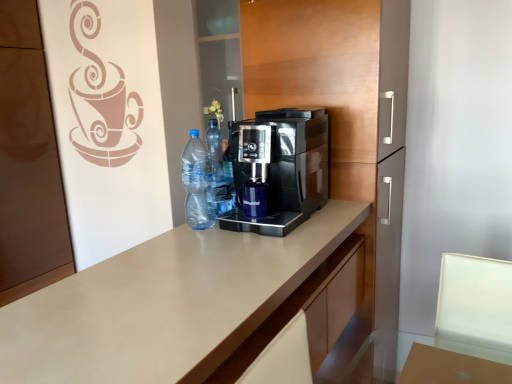
Question: From a real-world perspective, is transparent plastic bottle at center, which is the first bottle in front-to-back order, physically below translucent plastic bottles at center, which is the first bottle in back-to-front order?

Choices:
 (A) yes
 (B) no

Answer: (A)

Question: Is transparent plastic bottle at center, which is the first bottle in front-to-back order, directly adjacent to translucent plastic bottles at center, which is the first bottle in back-to-front order?

Choices:
 (A) yes
 (B) no

Answer: (A)

Question: Could you tell me if transparent plastic bottle at center, positioned as the second bottle in back-to-front order, is facing translucent plastic bottles at center, arranged as the second bottle when viewed from the front?

Choices:
 (A) no
 (B) yes

Answer: (B)

Question: Is there a large distance between transparent plastic bottle at center, which is the first bottle in front-to-back order, and translucent plastic bottles at center, which is the first bottle in back-to-front order?

Choices:
 (A) yes
 (B) no

Answer: (B)

Question: Can you confirm if transparent plastic bottle at center, positioned as the second bottle in back-to-front order, is shorter than translucent plastic bottles at center, which is the first bottle in back-to-front order?

Choices:
 (A) yes
 (B) no

Answer: (A)

Question: Considering their positions, is black glossy coffee machine at center located in front of or behind beige laminate countertop at center?

Choices:
 (A) front
 (B) behind

Answer: (B)

Question: In the image, is black glossy coffee machine at center on the left side or the right side of beige laminate countertop at center?

Choices:
 (A) left
 (B) right

Answer: (B)

Question: Choose the correct answer: Is black glossy coffee machine at center inside beige laminate countertop at center or outside it?

Choices:
 (A) inside
 (B) outside

Answer: (B)

Question: Based on their sizes in the image, would you say black glossy coffee machine at center is bigger or smaller than beige laminate countertop at center?

Choices:
 (A) big
 (B) small

Answer: (B)

Question: From the image's perspective, is black glossy coffee maker at center located above or below translucent plastic bottles at center, which is the first bottle in back-to-front order?

Choices:
 (A) above
 (B) below

Answer: (A)

Question: From their relative heights in the image, would you say black glossy coffee maker at center is taller or shorter than translucent plastic bottles at center, which is the first bottle in back-to-front order?

Choices:
 (A) short
 (B) tall

Answer: (B)

Question: Which is correct: black glossy coffee maker at center is inside translucent plastic bottles at center, which is the first bottle in back-to-front order, or outside of it?

Choices:
 (A) outside
 (B) inside

Answer: (A)

Question: In the image, is black glossy coffee maker at center positioned in front of or behind translucent plastic bottles at center, arranged as the second bottle when viewed from the front?

Choices:
 (A) front
 (B) behind

Answer: (A)

Question: In terms of height, does black glossy coffee machine at center look taller or shorter compared to transparent glass table at lower right?

Choices:
 (A) short
 (B) tall

Answer: (B)

Question: Considering the positions of black glossy coffee machine at center and transparent glass table at lower right in the image, is black glossy coffee machine at center wider or thinner than transparent glass table at lower right?

Choices:
 (A) wide
 (B) thin

Answer: (A)